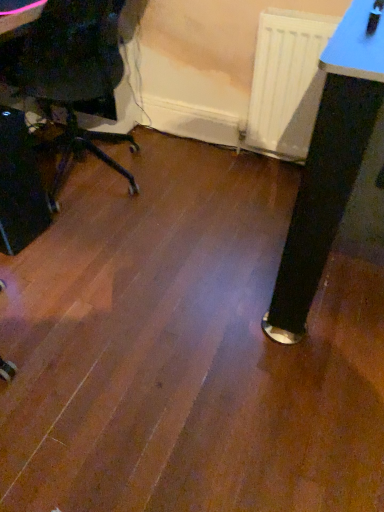
Question: Considering the relative positions of black plastic computer tower at left and white matte radiator at center in the image provided, is black plastic computer tower at left to the right of white matte radiator at center from the viewer's perspective?

Choices:
 (A) yes
 (B) no

Answer: (B)

Question: Is black plastic computer tower at left positioned beyond the bounds of white matte radiator at center?

Choices:
 (A) no
 (B) yes

Answer: (B)

Question: From a real-world perspective, is black plastic computer tower at left physically below white matte radiator at center?

Choices:
 (A) yes
 (B) no

Answer: (A)

Question: Is black plastic computer tower at left touching white matte radiator at center?

Choices:
 (A) no
 (B) yes

Answer: (A)

Question: Does black plastic computer tower at left appear on the left side of white matte radiator at center?

Choices:
 (A) no
 (B) yes

Answer: (B)

Question: Is black plastic computer tower at left in front of white matte radiator at center?

Choices:
 (A) yes
 (B) no

Answer: (A)

Question: Is white matte radiator at center aimed at black plastic computer tower at left?

Choices:
 (A) no
 (B) yes

Answer: (A)

Question: Does white matte radiator at center have a greater height compared to black plastic computer tower at left?

Choices:
 (A) no
 (B) yes

Answer: (B)

Question: From the image's perspective, is white matte radiator at center located above black plastic computer tower at left?

Choices:
 (A) no
 (B) yes

Answer: (B)

Question: Is white matte radiator at center not within black plastic computer tower at left?

Choices:
 (A) no
 (B) yes

Answer: (B)

Question: Is white matte radiator at center smaller than black plastic computer tower at left?

Choices:
 (A) yes
 (B) no

Answer: (A)

Question: Does white matte radiator at center contain black plastic computer tower at left?

Choices:
 (A) yes
 (B) no

Answer: (B)

Question: Considering their positions, is white matte radiator at center located in front of or behind black plastic computer tower at left?

Choices:
 (A) front
 (B) behind

Answer: (B)